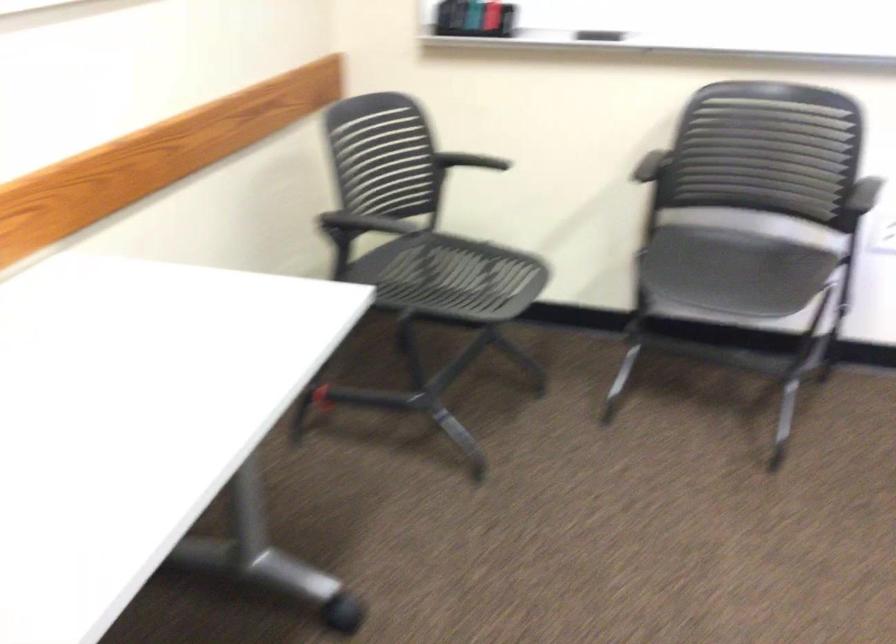
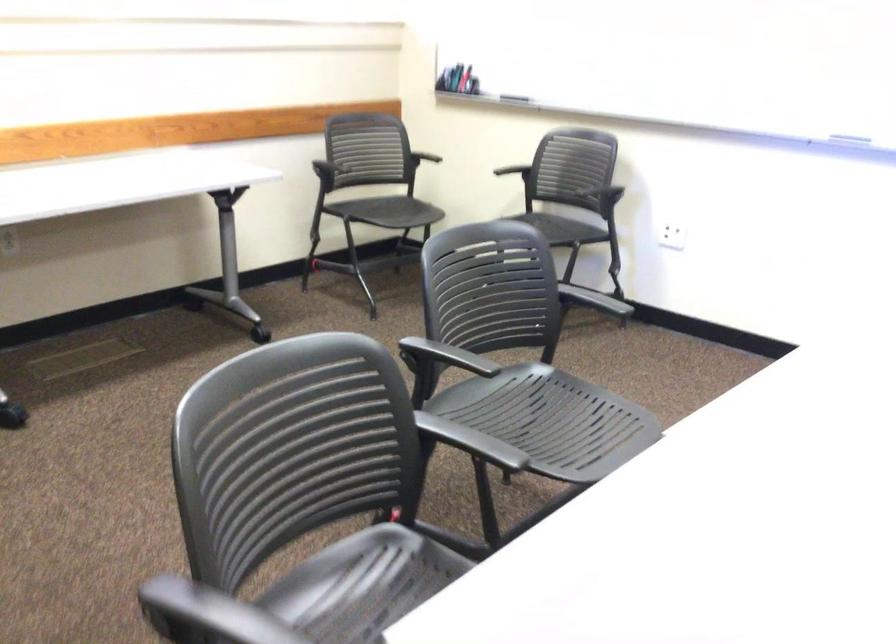
Question: I am providing you with two images of the same scene from different viewpoints. After the viewpoint changes to image2, which objects are now occluded?

Choices:
 (A) whiteboard marker
 (B) black chair armrest
 (C) chair sitting surface
 (D) none of these

Answer: (D)